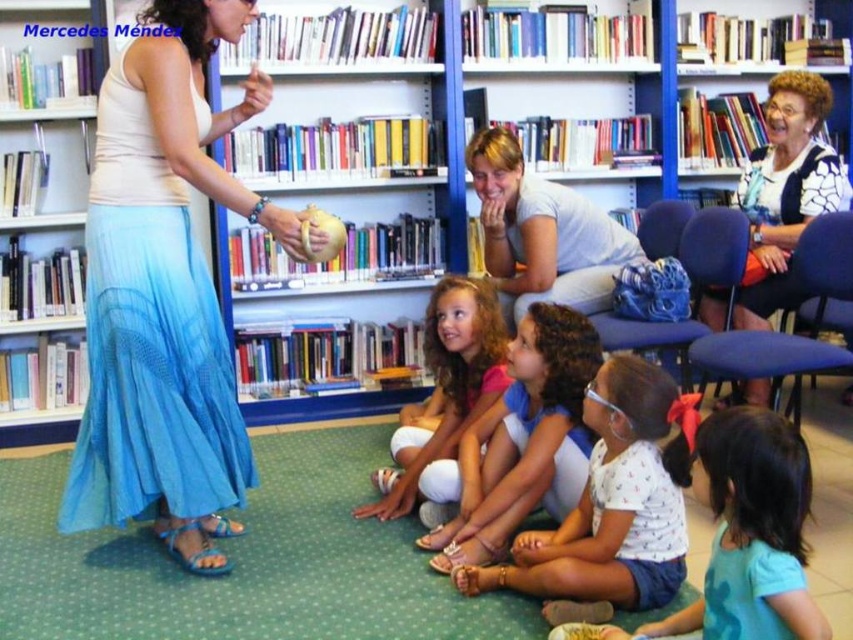
You are a photographer trying to capture a candid shot of the woman leading the activity. You notice the white cotton shirt at lower center and the light brown skin at center. Which one should you focus on to ensure you get a clear picture of her face?

The light brown skin at center is the part of her face, so focusing on it will ensure a clear picture of her face.